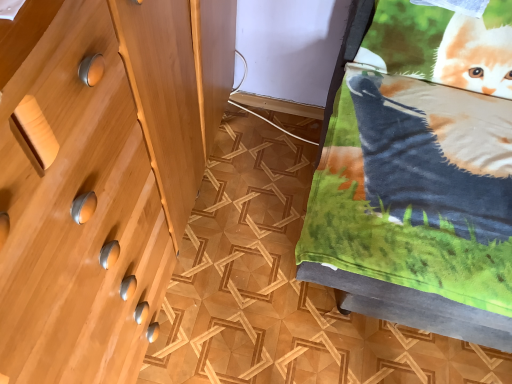
What do you see at coordinates (420, 176) in the screenshot? This screenshot has height=384, width=512. I see `fluffy fleece blanket at upper right` at bounding box center [420, 176].

You are a GUI agent. You are given a task and a screenshot of the screen. Output one action in this format:
    pyautogui.click(x=<x>, y=<y>)
    Task: Click on the fluffy fleece blanket at upper right
    The height and width of the screenshot is (384, 512).
    Given the screenshot: What is the action you would take?
    pyautogui.click(x=420, y=176)

Locate an element on the screen. The height and width of the screenshot is (384, 512). fluffy fleece blanket at upper right is located at coordinates (420, 176).